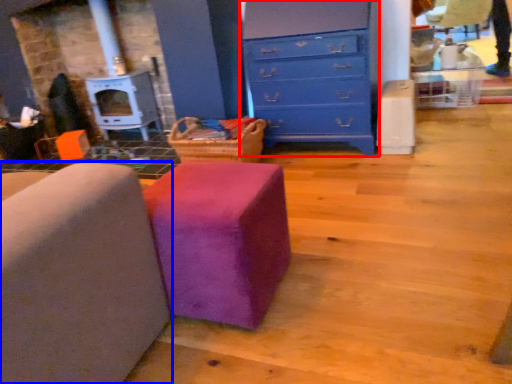
Question: Among these objects, which one is nearest to the camera, chest of drawers (highlighted by a red box) or furniture (highlighted by a blue box)?

Choices:
 (A) chest of drawers
 (B) furniture

Answer: (B)